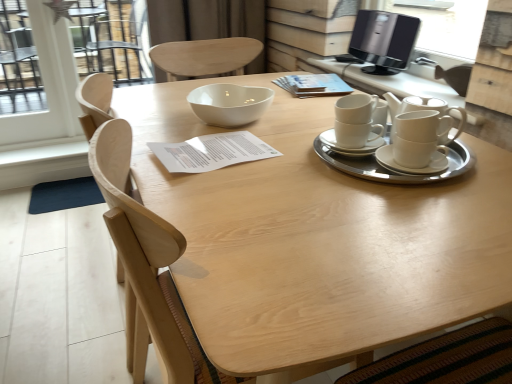
You are a GUI agent. You are given a task and a screenshot of the screen. Output one action in this format:
    pyautogui.click(x=<x>, y=<y>)
    Task: Click on the free space on the front side of white ceramic tea set at right
    
    Given the screenshot: What is the action you would take?
    (398, 215)